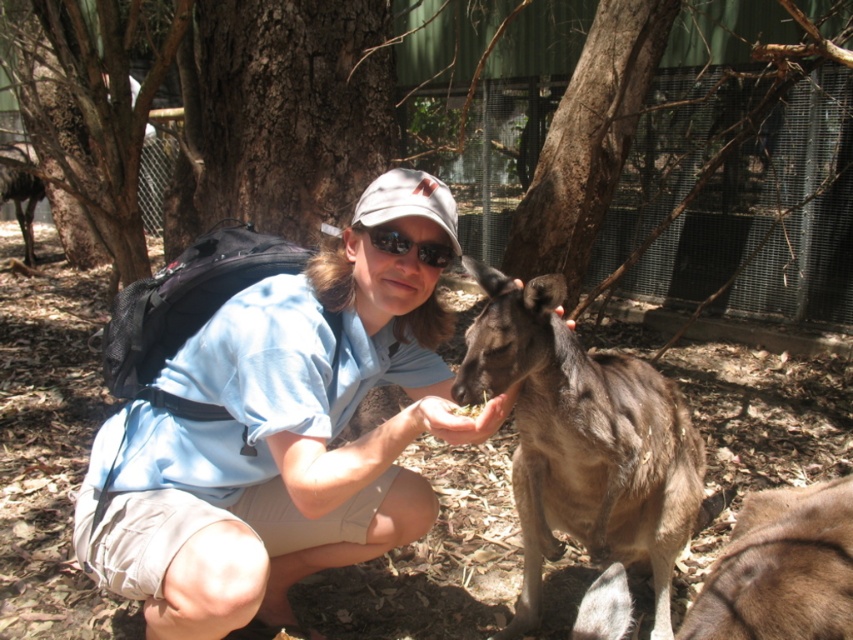
Question: Does blue fabric shirt at center appear on the right side of black reflective sunglasses at center?

Choices:
 (A) no
 (B) yes

Answer: (A)

Question: Is blue fabric shirt at center to the right of black reflective sunglasses at center from the viewer's perspective?

Choices:
 (A) no
 (B) yes

Answer: (A)

Question: Estimate the real-world distances between objects in this image. Which object is farther from the black reflective sunglasses at center?

Choices:
 (A) brown furry kangaroo at center
 (B) blue fabric shirt at center

Answer: (A)

Question: Considering the real-world distances, which object is closest to the brown furry kangaroo at center?

Choices:
 (A) black reflective sunglasses at center
 (B) blue fabric shirt at center

Answer: (B)

Question: Does blue fabric shirt at center appear on the left side of brown furry kangaroo at center?

Choices:
 (A) no
 (B) yes

Answer: (B)

Question: Which point is closer to the camera?

Choices:
 (A) blue fabric shirt at center
 (B) black reflective sunglasses at center
 (C) brown furry kangaroo at center

Answer: (C)